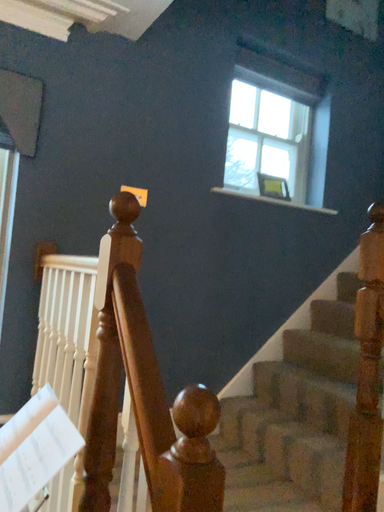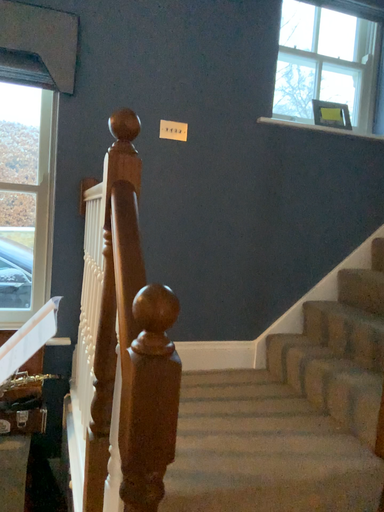
Question: How did the camera likely rotate when shooting the video?

Choices:
 (A) rotated upward
 (B) rotated downward

Answer: (B)